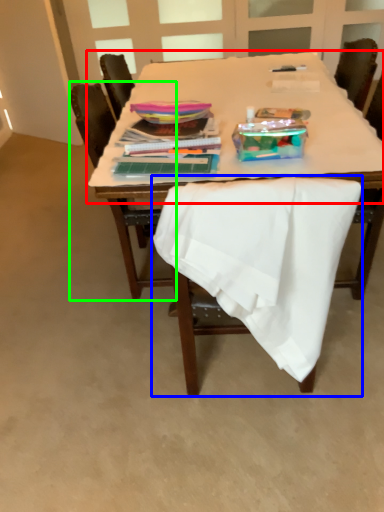
Question: Considering the real-world distances, which object is closest to round table (highlighted by a red box)? chair (highlighted by a blue box) or chair (highlighted by a green box).

Choices:
 (A) chair
 (B) chair

Answer: (B)